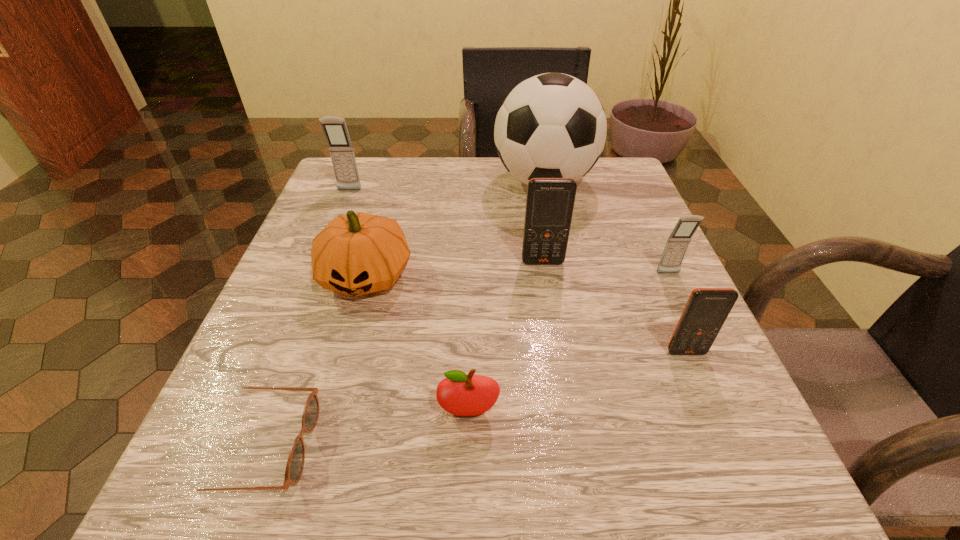
The height and width of the screenshot is (540, 960). Identify the location of the nearer gray cellular telephone. (676, 246).

Identify the location of the fifth object from right to left. (464, 395).

You are a GUI agent. You are given a task and a screenshot of the screen. Output one action in this format:
    pyautogui.click(x=<x>, y=<y>)
    Task: Click on the seventh tallest object
    Image resolution: width=960 pixels, height=540 pixels.
    Given the screenshot: What is the action you would take?
    pyautogui.click(x=464, y=395)

Identify the location of sunglasses. (295, 463).

At what (x,y) coordinates should I click in order to perform the action: click on the shortest object. Please return your answer as a coordinate pair (x, y). The image size is (960, 540). Looking at the image, I should click on (295, 463).

Find the location of a particular element. This screenshot has width=960, height=540. free space located on the right of the black soccer ball is located at coordinates (633, 181).

You are a GUI agent. You are given a task and a screenshot of the screen. Output one action in this format:
    pyautogui.click(x=<x>, y=<y>)
    Task: Click on the vacant space located 0.390m on the front-facing side of the leftmost cellular telephone
    This screenshot has height=540, width=960.
    Given the screenshot: What is the action you would take?
    [x=297, y=321]

You are a GUI agent. You are given a task and a screenshot of the screen. Output one action in this format:
    pyautogui.click(x=<x>, y=<y>)
    Task: Click on the vacant area located 0.340m on the screen of the farther orange cellular telephone
    Image resolution: width=960 pixels, height=540 pixels.
    Given the screenshot: What is the action you would take?
    pyautogui.click(x=570, y=437)

Locate an element on the screen. vacant space located on the side of the gourd with the carved face is located at coordinates (338, 376).

You are a GUI agent. You are given a task and a screenshot of the screen. Output one action in this format:
    pyautogui.click(x=<x>, y=<y>)
    Task: Click on the free space located 0.200m on the screen of the nearest cellular telephone
    The image size is (960, 540).
    Given the screenshot: What is the action you would take?
    pyautogui.click(x=745, y=491)